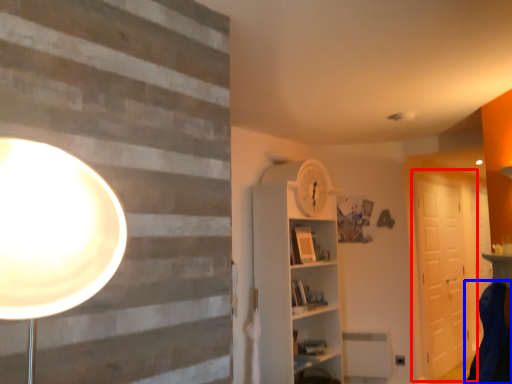
Question: Which object appears closest to the camera in this image, barn door (highlighted by a red box) or swivel chair (highlighted by a blue box)?

Choices:
 (A) barn door
 (B) swivel chair

Answer: (B)